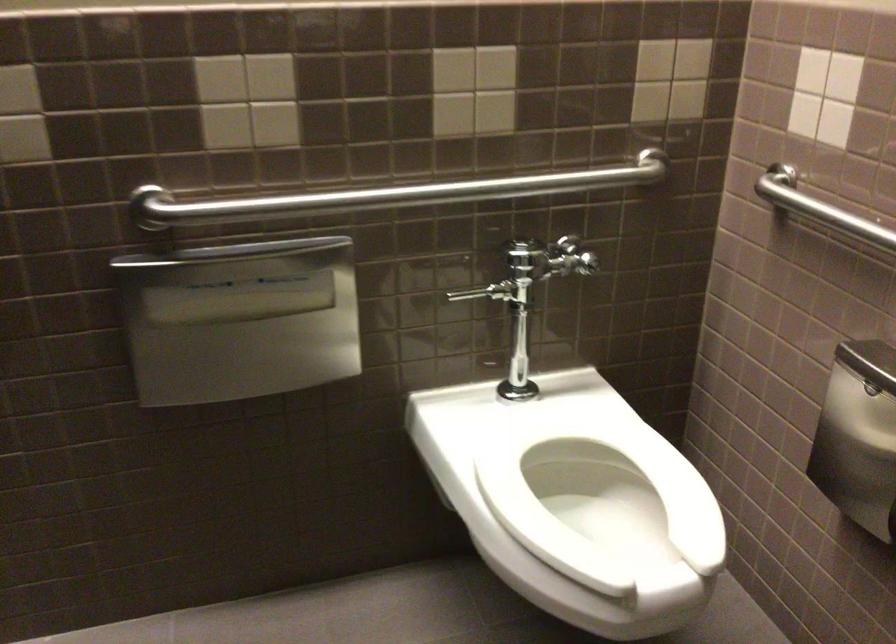
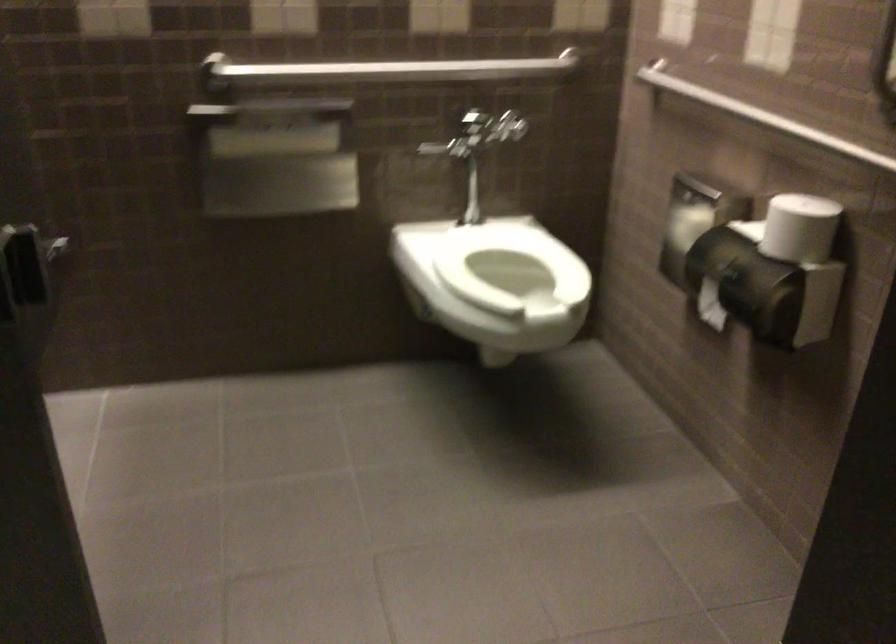
Question: In a continuous first-person perspective shot, in which direction is the camera moving?

Choices:
 (A) Left
 (B) Right
 (C) Forward
 (D) Backward

Answer: (D)